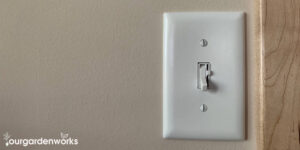
The height and width of the screenshot is (150, 300). Identify the location of lower right corner of switchplate. (243, 137).